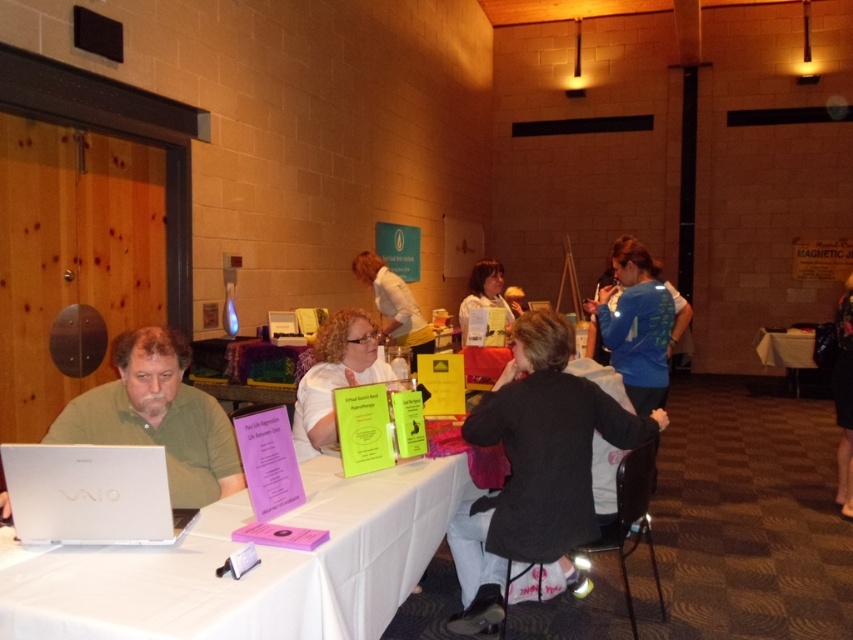
Between silver metallic laptop at left and white fabric table at right, which one is positioned higher?

Positioned higher is silver metallic laptop at left.

Looking at this image, can you confirm if silver metallic laptop at left is shorter than white fabric table at right?

Indeed, silver metallic laptop at left has a lesser height compared to white fabric table at right.

The height and width of the screenshot is (640, 853). I want to click on silver metallic laptop at left, so click(91, 493).

Between point (548, 413) and point (813, 381), which one is positioned in front?

Point (548, 413) is more forward.

Who is higher up, black matte jacket at center or white fabric table at right?

Positioned higher is white fabric table at right.

Is point (520, 451) positioned after point (795, 374)?

No.

Where is `black matte jacket at center`? black matte jacket at center is located at coordinates (534, 465).

Is point (543, 428) behind point (51, 458)?

Yes.

Who is shorter, black matte jacket at center or silver metallic laptop at left?

Standing shorter between the two is silver metallic laptop at left.

Does point (509, 392) come closer to viewer compared to point (84, 525)?

That is False.

This screenshot has height=640, width=853. What are the coordinates of `black matte jacket at center` in the screenshot? It's located at (534, 465).